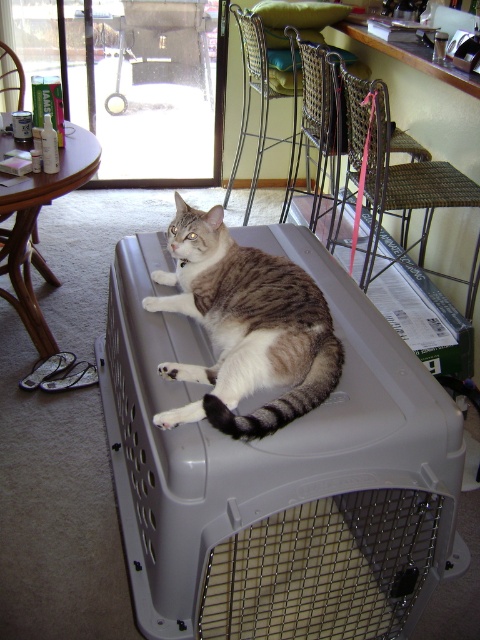
You are organizing a photo shoot and need to position a camera to capture both the tabby fur cat at center and the wooden table at left. Based on their positions, which object should be placed closer to the left side of the frame to ensure both are visible?

The wooden table at left should be placed closer to the left side of the frame since the tabby fur cat at center is to the right of it, ensuring both are visible in the photo.

You are a photographer wanting to capture the tabby fur cat at center and the woven wicker chair at center in a single shot. Can you fit both vertically in the frame if the camera has a maximum vertical height of 1.2 meters?

The tabby fur cat at center has a lesser height compared to woven wicker chair at center. Since the camera can accommodate up to 1.2 meters vertically, you need to ensure that the combined height of both objects does not exceed this limit. However, without knowing the exact heights of each, it is impossible to confirm if they will fit together.

You are a delivery person who needs to place a package on the floor between the tabby fur cat at center and the woven wicker chair at center. The package requires a minimum of 3 feet of space to avoid disturbing the cat. Can you safely place the package there?

The tabby fur cat at center is 3.41 feet away from the woven wicker chair at center. Since the required minimum space is 3 feet, the distance is sufficient. Therefore, you can safely place the package between them without disturbing the cat.